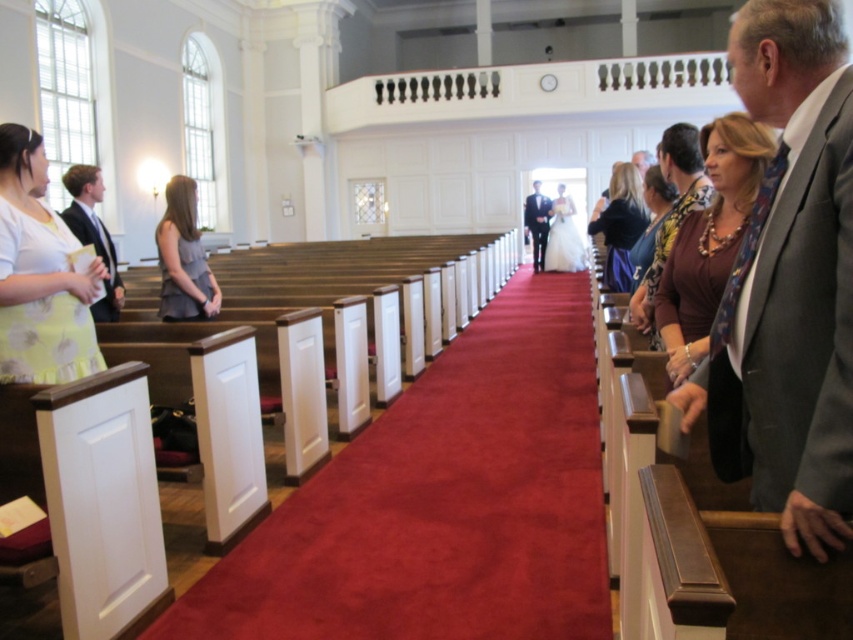
Question: Is yellow floral dress at left positioned at the back of matte black suit at left?

Choices:
 (A) no
 (B) yes

Answer: (A)

Question: Which of the following is the closest to the observer?

Choices:
 (A) matte black dress at center
 (B) gray suit at right
 (C) yellow floral dress at left

Answer: (B)

Question: Which of these objects is positioned closest to the yellow floral dress at left?

Choices:
 (A) white satin dress at center
 (B) velvet red carpet at center

Answer: (B)

Question: Can you confirm if printed silk blouse at center is bigger than gray fabric suit at upper right?

Choices:
 (A) yes
 (B) no

Answer: (B)

Question: Can you confirm if yellow floral dress at left is positioned above shiny black suit at center?

Choices:
 (A) yes
 (B) no

Answer: (B)

Question: Which of these objects is positioned closest to the brown fabric scarf at upper right?

Choices:
 (A) gray fabric suit at upper right
 (B) gray suit at right
 (C) brown fabric dress at right
 (D) shiny black suit at center

Answer: (C)